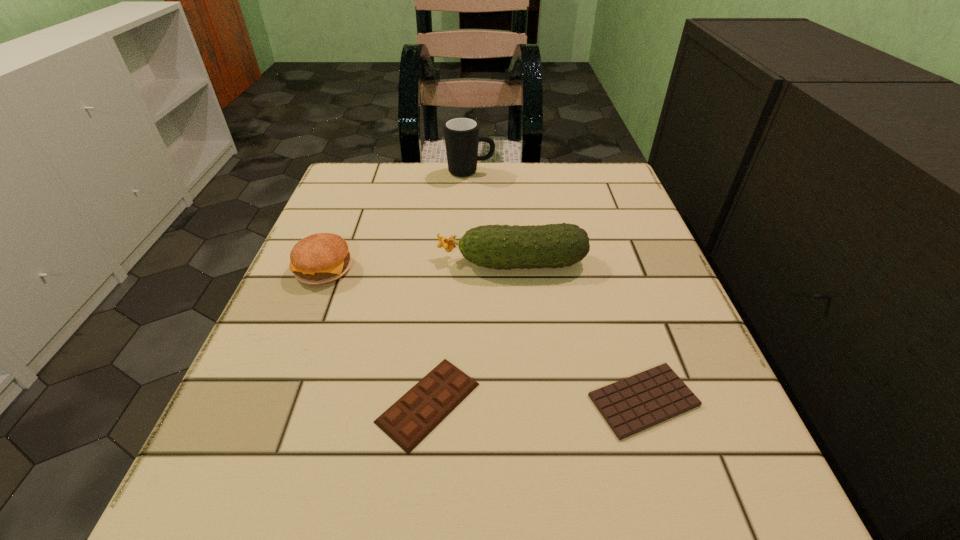
Find the location of a particular element. vacant space that satisfies the following two spatial constraints: 1. at the blossom end of the cucumber; 2. on the back side of the shorter chocolate bar is located at coordinates (524, 400).

In order to click on blank space that satisfies the following two spatial constraints: 1. at the blossom end of the shortest object; 2. on the right side of the cucumber in this screenshot , I will do `click(524, 400)`.

Identify the location of vacant area that satisfies the following two spatial constraints: 1. on the back side of the shorter chocolate bar; 2. on the side of the tallest object with the handle. (572, 172).